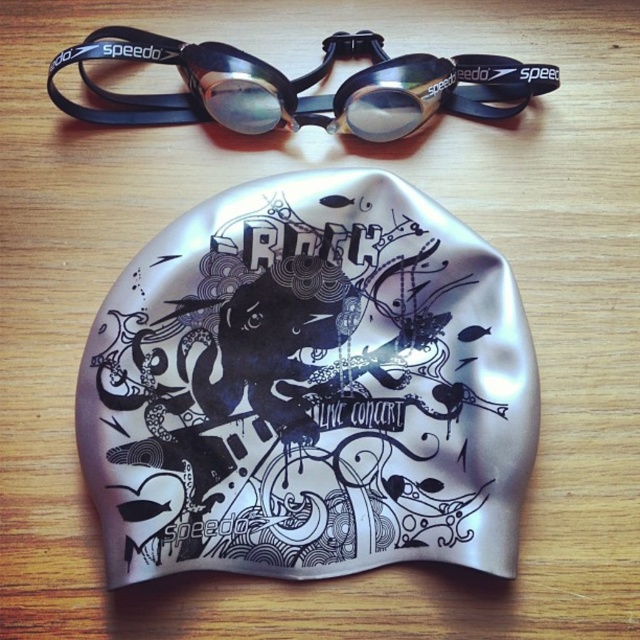
You are an athlete preparing for a competition and need to locate your equipment. You have a list of items to check off. The first item is the Speedo brand swim goggles at top. The second item is the silver colored swim cap with the word ROCK at center. You are currently looking at the point located at coordinates (x=308, y=387). Which of your equipment items is this point located on?

The point located at coordinates (x=308, y=387) is on the silver matte swim cap at center, which has the word ROCK in bold letters at its top center.

In the scene shown: You are an athlete preparing for a competition and need to place your silver matte swim cap at center and black rubber goggles at upper center on a shelf. The shelf has limited space. If you want to arrange them side by side horizontally, which object should be placed first to the left to fit properly?

The black rubber goggles at upper center should be placed first to the left since the silver matte swim cap at center is to the right of it, allowing them to be arranged side by side without overlapping.

You are organizing a swimmer kit and need to place the silver matte swim cap at center and the black rubber goggles at upper center into a drawer. The drawer has a height limit of 10 cm. If the goggles take up 6 cm of vertical space, will the swim cap fit below them without exceeding the drawer height?

The silver matte swim cap at center is located below the black rubber goggles at upper center. Since the goggles take up 6 cm vertically and the drawer has a 10 cm height limit, there would be 4 cm remaining. However, the question does not provide the swim cap height, so we cannot confirm if it fits.